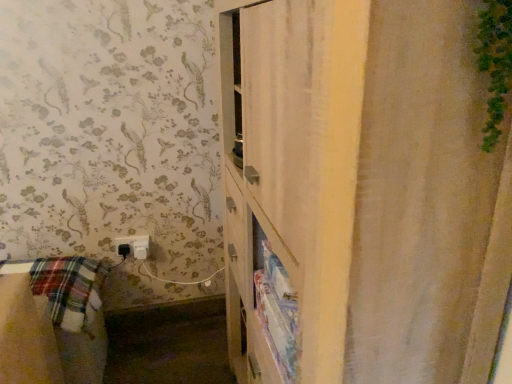
Question: Are white textured shower curtain at right and white plastic electric outlet at lower left making contact?

Choices:
 (A) no
 (B) yes

Answer: (A)

Question: Are white textured shower curtain at right and white plastic electric outlet at lower left far apart?

Choices:
 (A) no
 (B) yes

Answer: (B)

Question: Considering the relative sizes of white textured shower curtain at right and white plastic electric outlet at lower left in the image provided, is white textured shower curtain at right bigger than white plastic electric outlet at lower left?

Choices:
 (A) no
 (B) yes

Answer: (B)

Question: Is white textured shower curtain at right wider than white plastic electric outlet at lower left?

Choices:
 (A) no
 (B) yes

Answer: (B)

Question: From the image's perspective, does white textured shower curtain at right appear higher than white plastic electric outlet at lower left?

Choices:
 (A) yes
 (B) no

Answer: (A)

Question: Is white textured shower curtain at right outside white plastic electric outlet at lower left?

Choices:
 (A) no
 (B) yes

Answer: (B)

Question: Would you say white plastic electric outlet at lower left contains white textured shower curtain at right?

Choices:
 (A) no
 (B) yes

Answer: (A)

Question: Is white plastic electric outlet at lower left thinner than white textured shower curtain at right?

Choices:
 (A) yes
 (B) no

Answer: (A)

Question: Are white plastic electric outlet at lower left and white textured shower curtain at right far apart?

Choices:
 (A) no
 (B) yes

Answer: (B)

Question: Considering the relative sizes of white plastic electric outlet at lower left and white textured shower curtain at right in the image provided, is white plastic electric outlet at lower left wider than white textured shower curtain at right?

Choices:
 (A) yes
 (B) no

Answer: (B)

Question: From a real-world perspective, is white plastic electric outlet at lower left below white textured shower curtain at right?

Choices:
 (A) yes
 (B) no

Answer: (A)

Question: Can you confirm if white plastic electric outlet at lower left is positioned to the left of white textured shower curtain at right?

Choices:
 (A) yes
 (B) no

Answer: (A)

Question: Is point (123, 256) positioned closer to the camera than point (379, 243)?

Choices:
 (A) farther
 (B) closer

Answer: (A)